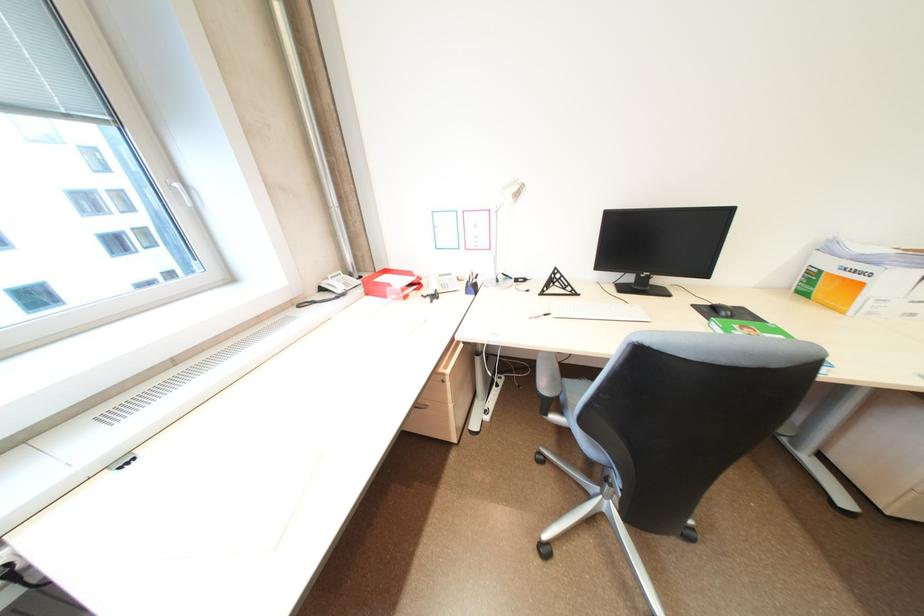
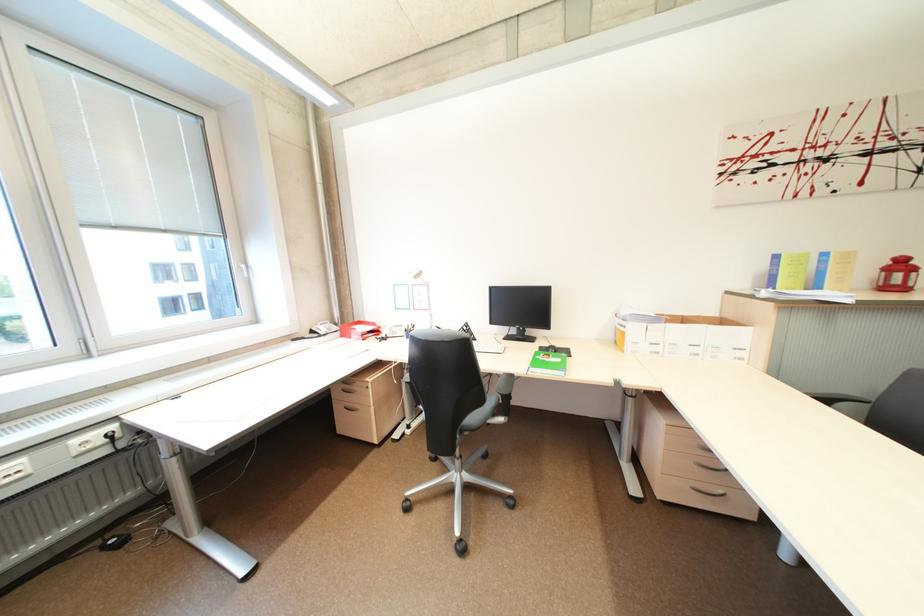
The point at (359,275) is marked in the first image. Where is the corresponding point in the second image?

(345, 325)